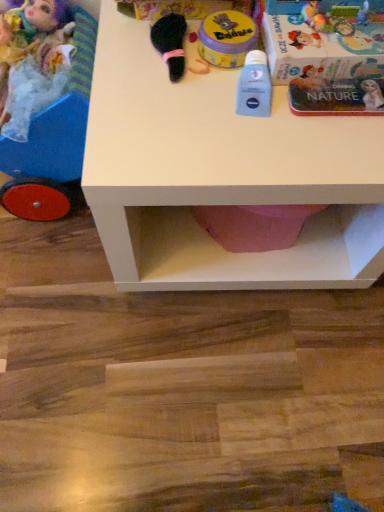
Locate an element on the screen. The image size is (384, 512). yellow matte container at upper center, acting as the 2th toy starting from the right is located at coordinates (227, 38).

What are the coordinates of `plush doll at left, which is the 1th toy in left-to-right order` in the screenshot? It's located at (32, 39).

From the picture: Are white matte table at center and metallic silver book at upper right beside each other?

No, white matte table at center is not with metallic silver book at upper right.

The height and width of the screenshot is (512, 384). Identify the location of table that is under the metallic silver book at upper right (from a real-world perspective). (220, 175).

Considering the positions of objects white matte table at center and metallic silver book at upper right in the image provided, who is more to the right, white matte table at center or metallic silver book at upper right?

From the viewer's perspective, metallic silver book at upper right appears more on the right side.

Does white matte table at center turn towards metallic silver book at upper right?

No, white matte table at center is not oriented towards metallic silver book at upper right.

From a real-world perspective, is plush doll at left, arranged as the fourth toy when viewed from the right, under yellow matte container at upper center, acting as the 2th toy starting from the right?

Yes, from a real-world perspective, plush doll at left, arranged as the fourth toy when viewed from the right, is under yellow matte container at upper center, acting as the 2th toy starting from the right.

Is plush doll at left, which is the 1th toy in left-to-right order, facing towards yellow matte container at upper center, acting as the 2th toy starting from the right?

No, plush doll at left, which is the 1th toy in left-to-right order, is not aimed at yellow matte container at upper center, acting as the 2th toy starting from the right.

Choose the correct answer: Is plush doll at left, arranged as the fourth toy when viewed from the right, inside yellow matte container at upper center, acting as the 2th toy starting from the right, or outside it?

plush doll at left, arranged as the fourth toy when viewed from the right, exists outside the volume of yellow matte container at upper center, acting as the 2th toy starting from the right.

Which object is positioned more to the left, matte plastic doll carriage at left, which is the 2th toy in left-to-right order, or blue matte lotion at center, the 1th toy viewed from the right?

Positioned to the left is matte plastic doll carriage at left, which is the 2th toy in left-to-right order.

Is matte plastic doll carriage at left, which is the 2th toy in left-to-right order, in front of or behind blue matte lotion at center, the 1th toy viewed from the right, in the image?

matte plastic doll carriage at left, which is the 2th toy in left-to-right order, is in front of blue matte lotion at center, the 1th toy viewed from the right.

Can you confirm if matte plastic doll carriage at left, placed as the 3th toy when sorted from right to left, is taller than blue matte lotion at center, the 1th toy viewed from the right?

Indeed, matte plastic doll carriage at left, placed as the 3th toy when sorted from right to left, has a greater height compared to blue matte lotion at center, the 1th toy viewed from the right.

Is matte plastic doll carriage at left, which is the 2th toy in left-to-right order, placed right next to blue matte lotion at center, which appears as the fourth toy when viewed from the left?

No, matte plastic doll carriage at left, which is the 2th toy in left-to-right order, is not making contact with blue matte lotion at center, which appears as the fourth toy when viewed from the left.

Can you tell me how much matte plastic doll carriage at left, placed as the 3th toy when sorted from right to left, and white matte table at center differ in facing direction?

matte plastic doll carriage at left, placed as the 3th toy when sorted from right to left, and white matte table at center are facing 4.15 degrees away from each other.

From the image's perspective, is matte plastic doll carriage at left, which is the 2th toy in left-to-right order, located above or below white matte table at center?

From the image's perspective, matte plastic doll carriage at left, which is the 2th toy in left-to-right order, appears above white matte table at center.

Based on the photo, is matte plastic doll carriage at left, which is the 2th toy in left-to-right order, to the right of white matte table at center from the viewer's perspective?

In fact, matte plastic doll carriage at left, which is the 2th toy in left-to-right order, is to the left of white matte table at center.

Which of these two, matte plastic doll carriage at left, placed as the 3th toy when sorted from right to left, or white matte table at center, is smaller?

With smaller size is matte plastic doll carriage at left, placed as the 3th toy when sorted from right to left.

Is point (42, 111) closer or farther from the camera than point (11, 25)?

Clearly, point (42, 111) is closer to the camera than point (11, 25).

Can you confirm if matte plastic doll carriage at left, placed as the 3th toy when sorted from right to left, is bigger than plush doll at left, which is the 1th toy in left-to-right order?

Indeed, matte plastic doll carriage at left, placed as the 3th toy when sorted from right to left, has a larger size compared to plush doll at left, which is the 1th toy in left-to-right order.

Does matte plastic doll carriage at left, placed as the 3th toy when sorted from right to left, have a lesser width compared to plush doll at left, which is the 1th toy in left-to-right order?

No.

Could you tell me if yellow matte container at upper center, acting as the 2th toy starting from the right, is facing metallic silver book at upper right?

No, yellow matte container at upper center, acting as the 2th toy starting from the right, is not turned towards metallic silver book at upper right.

How different are the orientations of yellow matte container at upper center, acting as the 2th toy starting from the right, and metallic silver book at upper right in degrees?

3.92 degrees separate the facing orientations of yellow matte container at upper center, acting as the 2th toy starting from the right, and metallic silver book at upper right.

Between yellow matte container at upper center, positioned as the third toy in left-to-right order, and metallic silver book at upper right, which one has more height?

With more height is metallic silver book at upper right.

Is yellow matte container at upper center, acting as the 2th toy starting from the right, not close to metallic silver book at upper right?

yellow matte container at upper center, acting as the 2th toy starting from the right, is near metallic silver book at upper right, not far away.

How much distance is there between yellow matte container at upper center, acting as the 2th toy starting from the right, and plush doll at left, arranged as the fourth toy when viewed from the right?

They are 13.56 inches apart.

Is yellow matte container at upper center, acting as the 2th toy starting from the right, touching plush doll at left, arranged as the fourth toy when viewed from the right?

No, yellow matte container at upper center, acting as the 2th toy starting from the right, is not beside plush doll at left, arranged as the fourth toy when viewed from the right.

Based on the photo, from a real-world perspective, is yellow matte container at upper center, acting as the 2th toy starting from the right, physically located above or below plush doll at left, which is the 1th toy in left-to-right order?

Clearly, from a real-world perspective, yellow matte container at upper center, acting as the 2th toy starting from the right, is above plush doll at left, which is the 1th toy in left-to-right order.

Is yellow matte container at upper center, positioned as the third toy in left-to-right order, thinner than plush doll at left, which is the 1th toy in left-to-right order?

Yes.

Locate an element on the screen. The height and width of the screenshot is (512, 384). box above the white matte table at center (from a real-world perspective) is located at coordinates (321, 49).

From the image's perspective, starting from the plush doll at left, which is the 1th toy in left-to-right order, which toy is the 1st one below? Please provide its 2D coordinates.

[(227, 38)]

Estimate the real-world distances between objects in this image. Which object is further from yellow matte container at upper center, acting as the 2th toy starting from the right, white matte table at center or matte plastic doll carriage at left, which is the 2th toy in left-to-right order?

The object further to yellow matte container at upper center, acting as the 2th toy starting from the right, is matte plastic doll carriage at left, which is the 2th toy in left-to-right order.

Which object lies nearer to the anchor point plush doll at left, which is the 1th toy in left-to-right order, yellow matte container at upper center, acting as the 2th toy starting from the right, or matte plastic doll carriage at left, placed as the 3th toy when sorted from right to left?

matte plastic doll carriage at left, placed as the 3th toy when sorted from right to left, is positioned closer to the anchor plush doll at left, which is the 1th toy in left-to-right order.

Which object lies nearer to the anchor point yellow matte container at upper center, positioned as the third toy in left-to-right order, plush doll at left, which is the 1th toy in left-to-right order, or matte plastic doll carriage at left, which is the 2th toy in left-to-right order?

matte plastic doll carriage at left, which is the 2th toy in left-to-right order, lies closer to yellow matte container at upper center, positioned as the third toy in left-to-right order, than the other object.

Considering their positions, is matte plastic doll carriage at left, which is the 2th toy in left-to-right order, positioned closer to plush doll at left, which is the 1th toy in left-to-right order, than yellow matte container at upper center, acting as the 2th toy starting from the right?

matte plastic doll carriage at left, which is the 2th toy in left-to-right order.

Which object lies nearer to the anchor point plush doll at left, arranged as the fourth toy when viewed from the right, blue matte lotion at center, which appears as the fourth toy when viewed from the left, or white matte table at center?

white matte table at center lies closer to plush doll at left, arranged as the fourth toy when viewed from the right, than the other object.

In the scene shown: Which object lies nearer to the anchor point matte plastic doll carriage at left, which is the 2th toy in left-to-right order, blue matte lotion at center, which appears as the fourth toy when viewed from the left, or white matte table at center?

white matte table at center lies closer to matte plastic doll carriage at left, which is the 2th toy in left-to-right order, than the other object.

Looking at the image, which one is located further to blue matte lotion at center, which appears as the fourth toy when viewed from the left, metallic silver book at upper right or yellow matte container at upper center, acting as the 2th toy starting from the right?

Based on the image, metallic silver book at upper right appears to be further to blue matte lotion at center, which appears as the fourth toy when viewed from the left.

Which object lies nearer to the anchor point metallic silver book at upper right, plush doll at left, arranged as the fourth toy when viewed from the right, or matte plastic doll carriage at left, placed as the 3th toy when sorted from right to left?

Among the two, matte plastic doll carriage at left, placed as the 3th toy when sorted from right to left, is located nearer to metallic silver book at upper right.

In order to click on toy between plush doll at left, which is the 1th toy in left-to-right order, and yellow matte container at upper center, acting as the 2th toy starting from the right, from left to right in this screenshot , I will do `click(57, 121)`.

In order to click on toy between yellow matte container at upper center, acting as the 2th toy starting from the right, and metallic silver book at upper right in this screenshot , I will do `click(254, 86)`.

This screenshot has height=512, width=384. Find the location of `table between matte plastic doll carriage at left, which is the 2th toy in left-to-right order, and metallic silver book at upper right from left to right`. table between matte plastic doll carriage at left, which is the 2th toy in left-to-right order, and metallic silver book at upper right from left to right is located at coordinates (220, 175).

This screenshot has height=512, width=384. I want to click on toy between matte plastic doll carriage at left, placed as the 3th toy when sorted from right to left, and blue matte lotion at center, the 1th toy viewed from the right, so click(x=227, y=38).